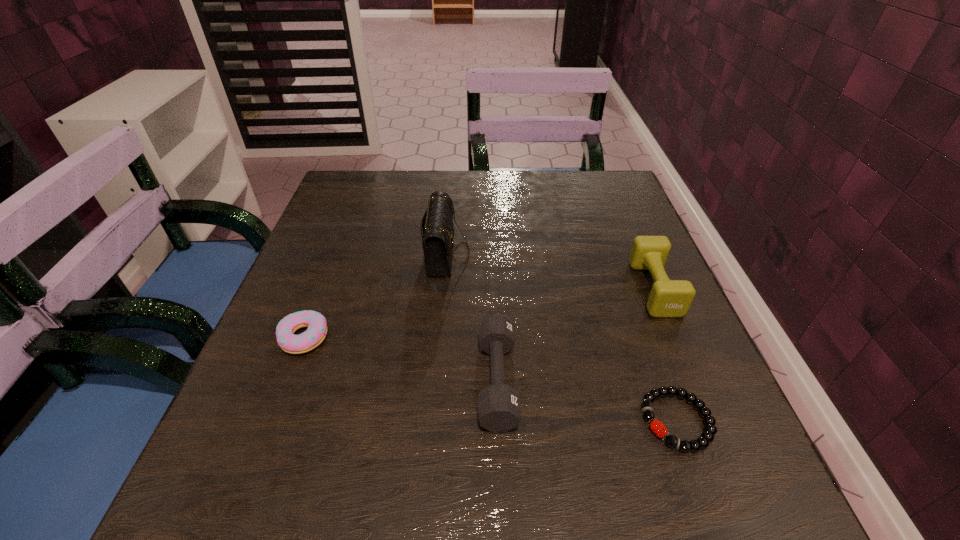
You are a GUI agent. You are given a task and a screenshot of the screen. Output one action in this format:
    pyautogui.click(x=<x>, y=<y>)
    Task: Click on the free point that satisfies the following two spatial constraints: 1. on the front flap of the fourth object from right to left; 2. on the left side of the farther dumbbell
    This screenshot has height=540, width=960.
    Given the screenshot: What is the action you would take?
    pyautogui.click(x=444, y=288)

Find the location of `vacant space that satisfies the following two spatial constraints: 1. on the front flap of the fourth object from right to left; 2. on the left side of the farther dumbbell`. vacant space that satisfies the following two spatial constraints: 1. on the front flap of the fourth object from right to left; 2. on the left side of the farther dumbbell is located at coordinates (444, 288).

Image resolution: width=960 pixels, height=540 pixels. Find the location of `blank space that satisfies the following two spatial constraints: 1. on the front flap of the fourth object from right to left; 2. on the right side of the right dumbbell`. blank space that satisfies the following two spatial constraints: 1. on the front flap of the fourth object from right to left; 2. on the right side of the right dumbbell is located at coordinates (444, 288).

This screenshot has width=960, height=540. In order to click on vacant point that satisfies the following two spatial constraints: 1. on the front flap of the second object from left to right; 2. on the left side of the shorter dumbbell in this screenshot , I will do pyautogui.click(x=435, y=380).

Locate an element on the screen. This screenshot has width=960, height=540. free space that satisfies the following two spatial constraints: 1. on the front flap of the third shortest object; 2. on the left side of the clutch bag is located at coordinates (435, 380).